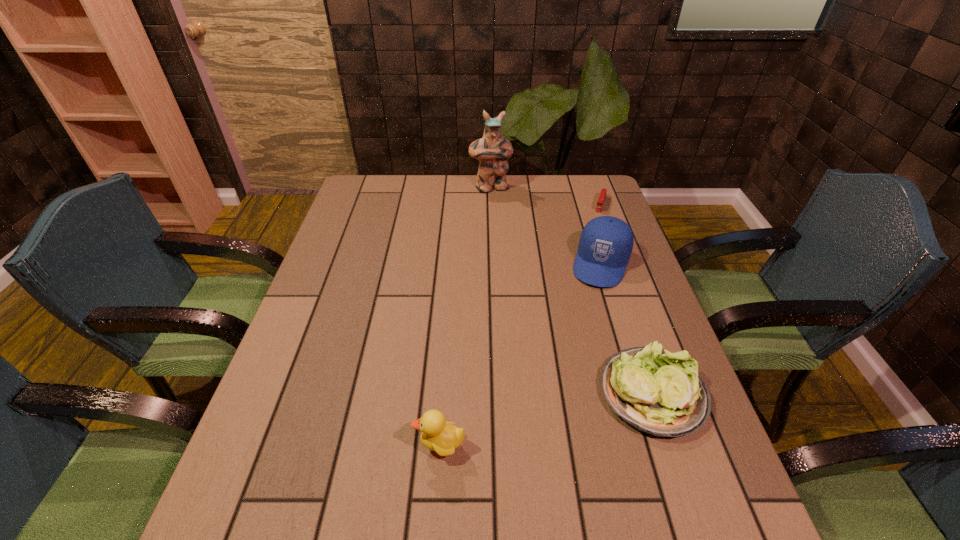
This screenshot has width=960, height=540. I want to click on figurine at the far edge, so click(492, 150).

In order to click on stapler at the far edge in this screenshot , I will do `click(600, 203)`.

Locate an element on the screen. Image resolution: width=960 pixels, height=540 pixels. duckling that is positioned at the near edge is located at coordinates (443, 438).

This screenshot has height=540, width=960. Find the location of `lettuce present at the near edge`. lettuce present at the near edge is located at coordinates (657, 392).

I want to click on lettuce at the right edge, so click(x=657, y=392).

The height and width of the screenshot is (540, 960). Find the location of `cap that is at the right edge`. cap that is at the right edge is located at coordinates (606, 243).

Find the location of a particular element. The image size is (960, 540). stapler present at the right edge is located at coordinates (600, 203).

Find the location of a particular element. object positioned at the far right corner is located at coordinates [x=600, y=203].

Find the location of a particular element. Image resolution: width=960 pixels, height=540 pixels. object located in the near right corner section of the desktop is located at coordinates coord(657,392).

At what (x,y) coordinates should I click in order to perform the action: click on vacant position at the far edge of the desktop. Please return your answer as a coordinate pair (x, y). The width and height of the screenshot is (960, 540). Looking at the image, I should click on (405, 194).